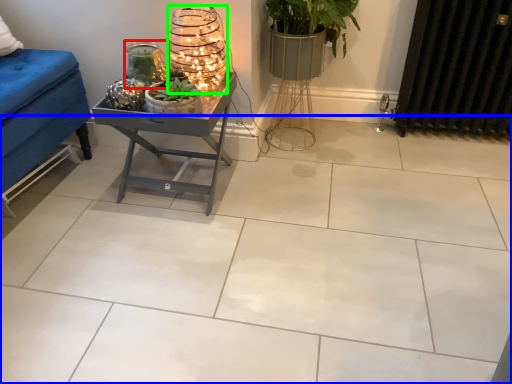
Question: Estimate the real-world distances between objects in this image. Which object is farther from candle holder (highlighted by a red box), ceramic tile (highlighted by a blue box) or candle holder (highlighted by a green box)?

Choices:
 (A) ceramic tile
 (B) candle holder

Answer: (A)